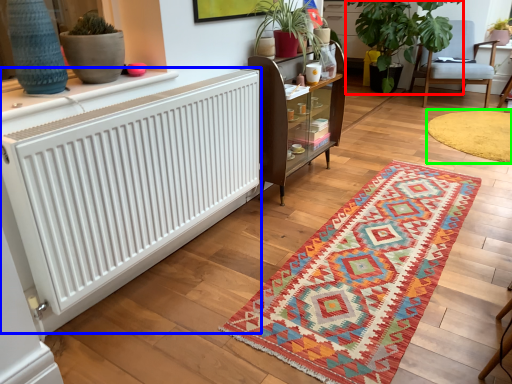
Question: Based on their relative distances, which object is nearer to houseplant (highlighted by a red box)? Choose from radiator (highlighted by a blue box) and mat (highlighted by a green box).

Choices:
 (A) radiator
 (B) mat

Answer: (B)